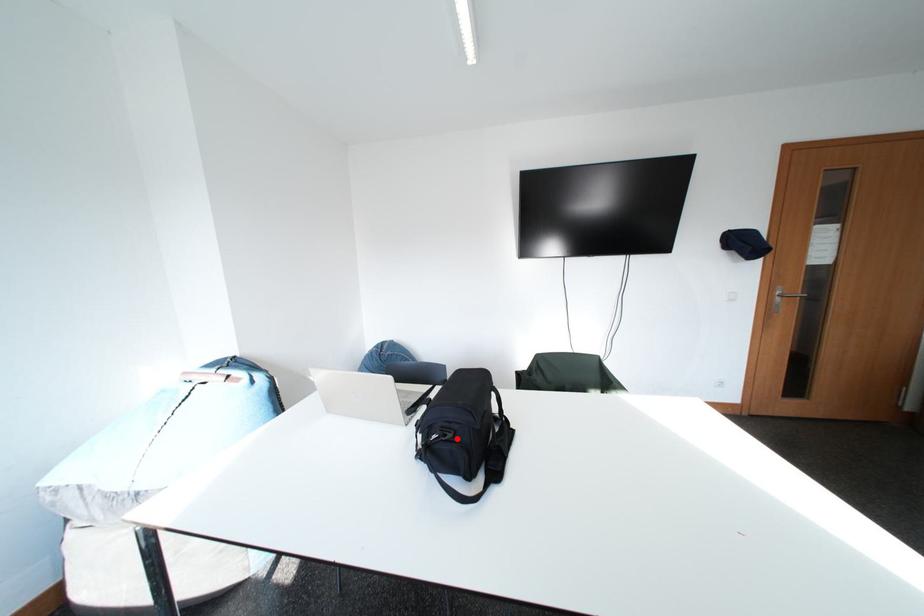
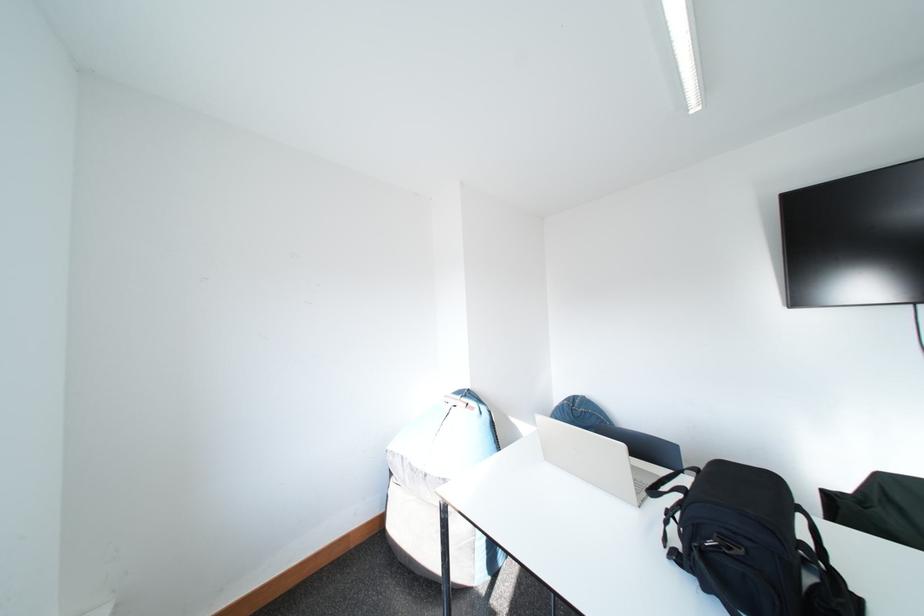
Locate, in the second image, the point that corresponds to the highlighted location in the first image.

(743, 552)